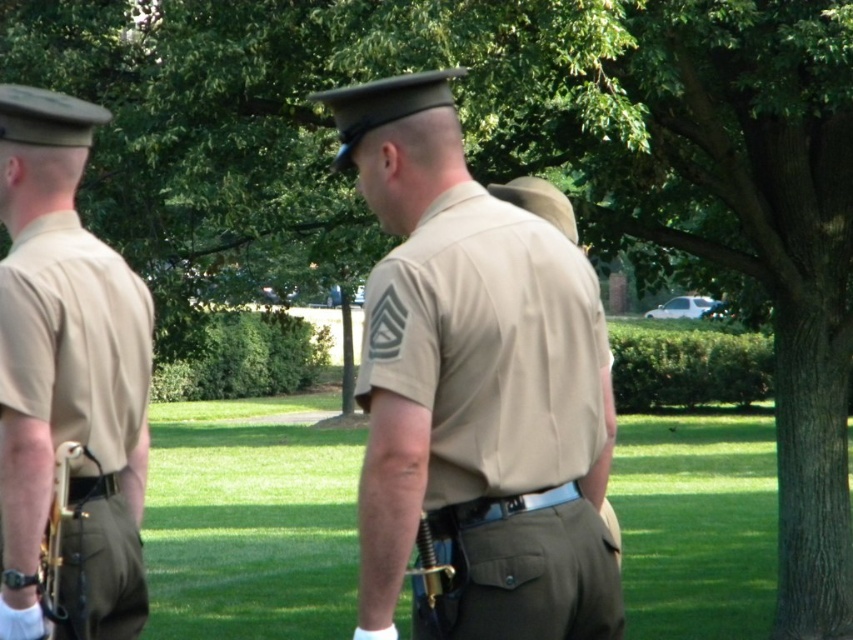
You are a photographer setting up a camera to capture the scene. You need to ensure that the tan fabric shirt at center and the matte khaki uniform at left are both in focus. Given that the camera can only focus on objects within a 1.5 meter width, will both objects fit within this focus range?

The tan fabric shirt at center is wider than the matte khaki uniform at left. However, the camera can focus on objects within a 1.5 meter width. Since the question does not provide specific measurements for either object, it is impossible to determine if both will fit within the focus range based on the given information.